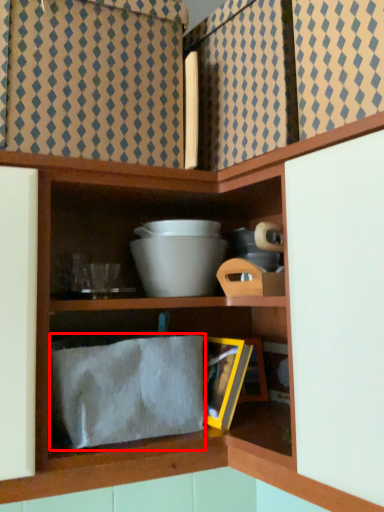
Question: From the image's perspective, what is the correct spatial positioning of cloth (annotated by the red box) in reference to bowl?

Choices:
 (A) above
 (B) below

Answer: (B)